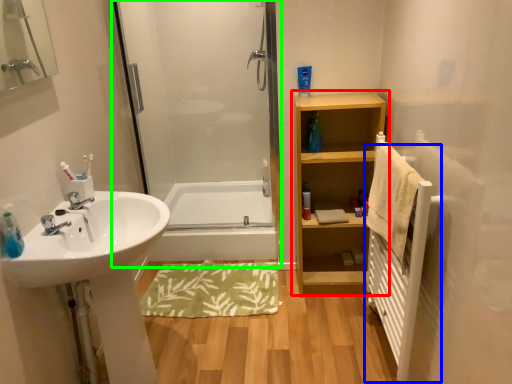
Question: Considering the real-world distances, which object is farthest from bathroom cabinet (highlighted by a red box)? radiator (highlighted by a blue box) or screen door (highlighted by a green box)?

Choices:
 (A) radiator
 (B) screen door

Answer: (B)